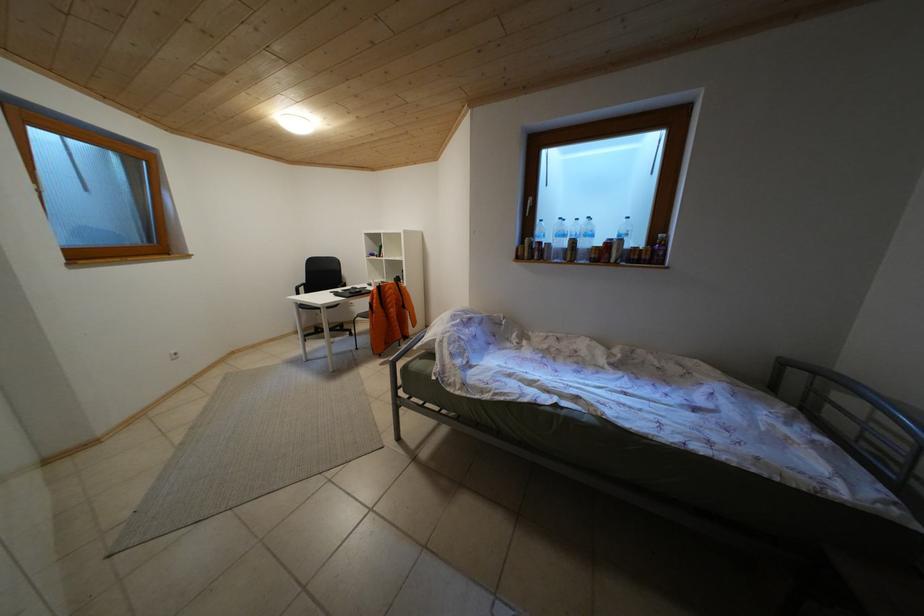
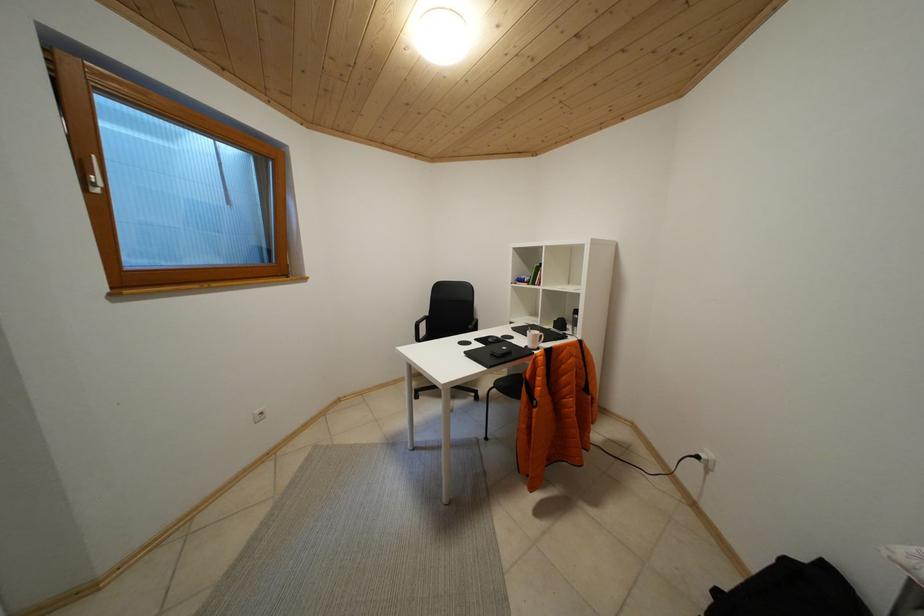
Based on the photo, which direction would the cameraman need to move to produce the second image?

The cameraman moved toward left, forward.